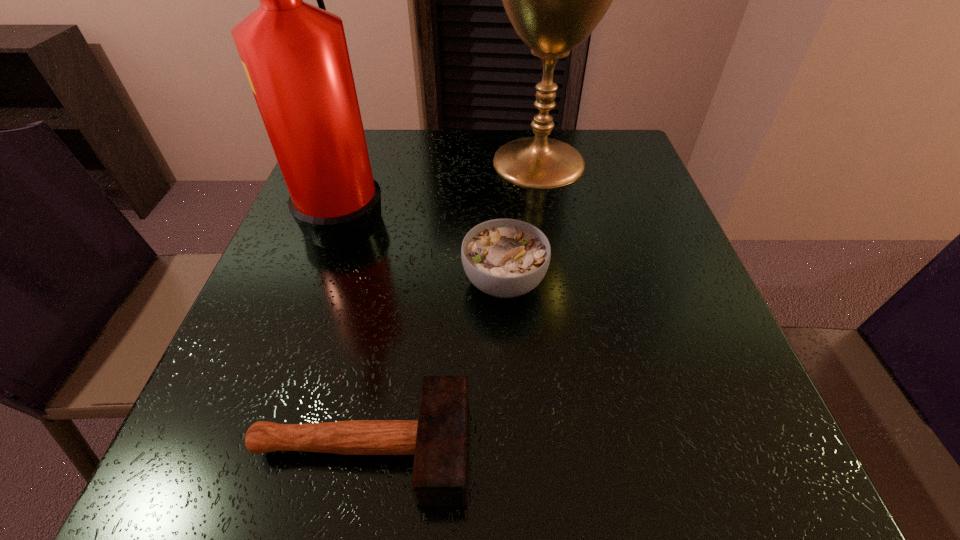
This screenshot has height=540, width=960. In order to click on trophy cup in this screenshot , I will do `click(554, 0)`.

Identify the location of fire extinguisher. (295, 55).

Where is `soup bowl`? This screenshot has width=960, height=540. soup bowl is located at coordinates (505, 258).

This screenshot has width=960, height=540. What are the coordinates of `the nearest object` in the screenshot? It's located at tap(438, 440).

The image size is (960, 540). I want to click on the shortest object, so click(438, 440).

Identify the location of vacant position located on the front of the trophy cup. (550, 228).

Locate an element on the screen. This screenshot has width=960, height=540. vacant region located 0.090m at the spray nozzle of the fire extinguisher is located at coordinates (430, 212).

At what (x,y) coordinates should I click in order to perform the action: click on vacant space situated 0.160m on the back of the soup bowl. Please return your answer as a coordinate pair (x, y). The image size is (960, 540). Looking at the image, I should click on (500, 203).

You are a GUI agent. You are given a task and a screenshot of the screen. Output one action in this format:
    pyautogui.click(x=<x>, y=<y>)
    Task: Click on the vacant space located on the hammer head face of the mallet
    
    Given the screenshot: What is the action you would take?
    pyautogui.click(x=662, y=448)

This screenshot has width=960, height=540. I want to click on trophy cup present at the far edge, so click(x=554, y=0).